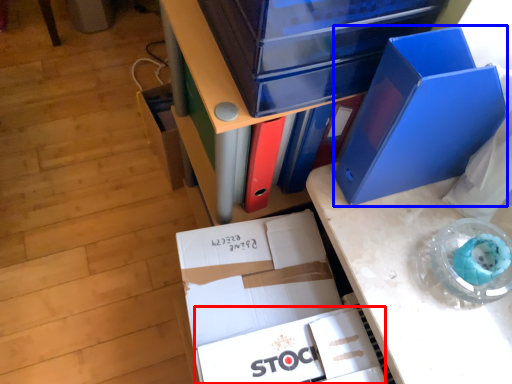
Question: Which point is further to the camera, paperback book (highlighted by a red box) or paperback book (highlighted by a blue box)?

Choices:
 (A) paperback book
 (B) paperback book

Answer: (A)